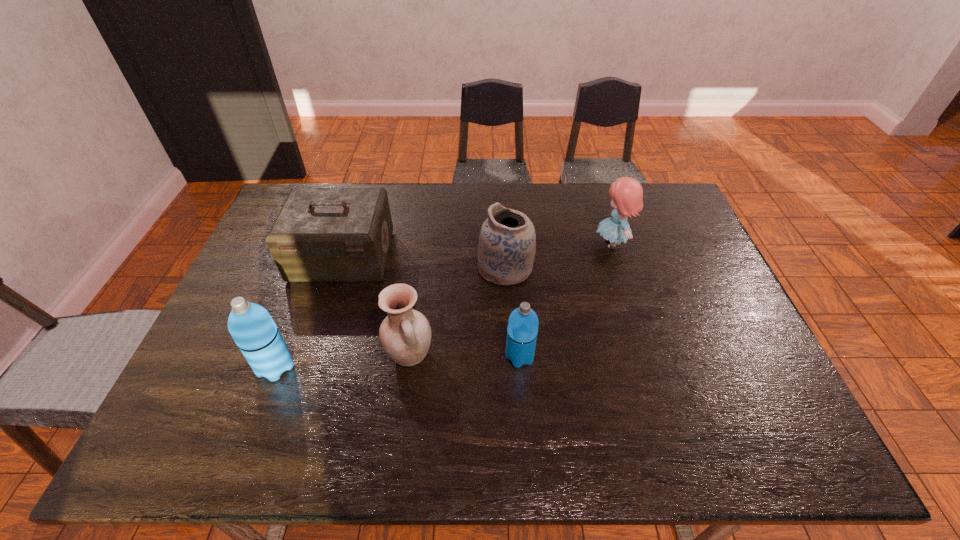
Locate an element on the screen. This screenshot has width=960, height=540. object at the near left corner is located at coordinates (251, 326).

Locate an element on the screen. The image size is (960, 540). vacant space at the far edge of the desktop is located at coordinates (408, 204).

In the image, there is a desktop. Where is `vacant space at the near edge`? The height and width of the screenshot is (540, 960). vacant space at the near edge is located at coordinates (635, 378).

The width and height of the screenshot is (960, 540). What are the coordinates of `free location at the right edge of the desktop` in the screenshot? It's located at (657, 241).

In the image, there is a desktop. At what (x,y) coordinates should I click in order to perform the action: click on vacant space at the far left corner. Please return your answer as a coordinate pair (x, y). Image resolution: width=960 pixels, height=540 pixels. Looking at the image, I should click on (298, 185).

This screenshot has width=960, height=540. What are the coordinates of `free space between the taller thermos bottle and the doll` in the screenshot? It's located at (444, 306).

At what (x,y) coordinates should I click in order to perform the action: click on free space between the fourth object from right to left and the left thermos bottle. Please return your answer as a coordinate pair (x, y). Image resolution: width=960 pixels, height=540 pixels. Looking at the image, I should click on (343, 362).

Identify the location of empty location between the farther pottery and the rightmost object. (559, 256).

Find the location of a particular element. Image resolution: width=960 pixels, height=540 pixels. vacant area between the left pottery and the doll is located at coordinates (511, 300).

Where is `free point between the first-aid kit and the left pottery`? The image size is (960, 540). free point between the first-aid kit and the left pottery is located at coordinates (376, 306).